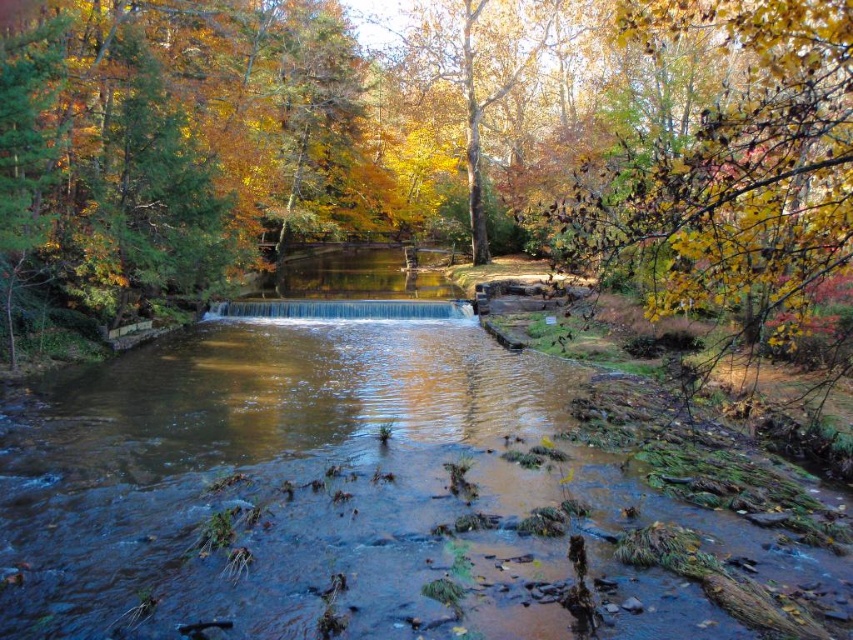
Can you confirm if brown smooth water at center is positioned to the left of yellow leafy branch at upper right?

Correct, you'll find brown smooth water at center to the left of yellow leafy branch at upper right.

Find the location of a particular element. brown smooth water at center is located at coordinates (334, 484).